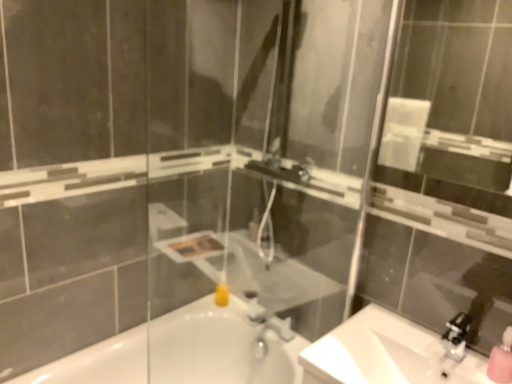
I want to click on matte silver faucet at center, so click(x=266, y=325).

The image size is (512, 384). In order to click on pink matte soap dispenser at lower right in this screenshot , I will do `click(501, 360)`.

Describe the element at coordinates (218, 347) in the screenshot. The height and width of the screenshot is (384, 512). I see `white glossy bathtub at lower center` at that location.

This screenshot has height=384, width=512. Describe the element at coordinates (456, 336) in the screenshot. I see `satin nickel faucet at lower right` at that location.

The image size is (512, 384). What are the coordinates of `satin nickel faucet at lower right` in the screenshot? It's located at (456, 336).

Locate an element on the screen. The height and width of the screenshot is (384, 512). white glossy sink at lower right is located at coordinates (384, 353).

You are a GUI agent. You are given a task and a screenshot of the screen. Output one action in this format:
    pyautogui.click(x=<x>, y=<y>)
    Task: Click on the matte silver faucet at center
    The image size is (512, 384).
    Given the screenshot: What is the action you would take?
    pyautogui.click(x=266, y=325)

How different are the orientations of clear glass mirror at upper center and pink matte soap dispenser at lower right in degrees?

There is a 1.48-degree angle between the facing directions of clear glass mirror at upper center and pink matte soap dispenser at lower right.

Looking at this image, from the image's perspective, is clear glass mirror at upper center under pink matte soap dispenser at lower right?

Incorrect, from the image's perspective, clear glass mirror at upper center is higher than pink matte soap dispenser at lower right.

Is clear glass mirror at upper center positioned far away from pink matte soap dispenser at lower right?

That's right, there is a large distance between clear glass mirror at upper center and pink matte soap dispenser at lower right.

Is matte silver faucet at center positioned beyond the bounds of pink matte soap dispenser at lower right?

Yes, matte silver faucet at center is not within pink matte soap dispenser at lower right.

Can you confirm if matte silver faucet at center is thinner than pink matte soap dispenser at lower right?

No, matte silver faucet at center is not thinner than pink matte soap dispenser at lower right.

Can you confirm if matte silver faucet at center is positioned to the right of pink matte soap dispenser at lower right?

In fact, matte silver faucet at center is to the left of pink matte soap dispenser at lower right.

In terms of height, does satin nickel faucet at lower right look taller or shorter compared to white glossy sink at lower right?

satin nickel faucet at lower right is shorter than white glossy sink at lower right.

Can we say satin nickel faucet at lower right lies outside white glossy sink at lower right?

satin nickel faucet at lower right is positioned outside white glossy sink at lower right.

Considering the points (442, 343) and (307, 356), which point is in front, point (442, 343) or point (307, 356)?

The point (307, 356) is in front.

From a real-world perspective, is satin nickel faucet at lower right physically above white glossy sink at lower right?

Yes, from a real-world perspective, satin nickel faucet at lower right is over white glossy sink at lower right

Is matte silver faucet at center with clear glass mirror at upper center?

matte silver faucet at center and clear glass mirror at upper center are clearly separated.

In the image, there is a clear glass mirror at upper center. At what (x,y) coordinates should I click in order to perform the action: click on tap below it (from the image's perspective). Please return your answer as a coordinate pair (x, y). Image resolution: width=512 pixels, height=384 pixels. Looking at the image, I should click on (266, 325).

Which object is closer to the camera, matte silver faucet at center or clear glass mirror at upper center?

clear glass mirror at upper center is closer to the camera.

Consider the image. Is matte silver faucet at center shorter than clear glass mirror at upper center?

Yes.

Considering the sizes of pink matte soap dispenser at lower right and matte silver faucet at center in the image, is pink matte soap dispenser at lower right taller or shorter than matte silver faucet at center?

Clearly, pink matte soap dispenser at lower right is taller compared to matte silver faucet at center.

Considering the relative sizes of pink matte soap dispenser at lower right and matte silver faucet at center in the image provided, is pink matte soap dispenser at lower right bigger than matte silver faucet at center?

No.

Does pink matte soap dispenser at lower right turn towards matte silver faucet at center?

No, pink matte soap dispenser at lower right is not oriented towards matte silver faucet at center.

Does point (510, 372) lie in front of point (254, 342)?

Yes, point (510, 372) is in front of point (254, 342).

From a real-world perspective, is white glossy sink at lower right above or below clear glass mirror at upper center?

From a real-world perspective, white glossy sink at lower right is physically below clear glass mirror at upper center.

Between white glossy sink at lower right and clear glass mirror at upper center, which one appears on the right side from the viewer's perspective?

clear glass mirror at upper center is more to the right.

In terms of width, does white glossy sink at lower right look wider or thinner when compared to clear glass mirror at upper center?

In the image, white glossy sink at lower right appears to be wider than clear glass mirror at upper center.

Consider the image. Is white glossy sink at lower right further to camera compared to clear glass mirror at upper center?

That is True.

Can you confirm if satin nickel faucet at lower right is smaller than white glossy bathtub at lower center?

Correct, satin nickel faucet at lower right occupies less space than white glossy bathtub at lower center.

Choose the correct answer: Is satin nickel faucet at lower right inside white glossy bathtub at lower center or outside it?

satin nickel faucet at lower right is outside white glossy bathtub at lower center.

Is satin nickel faucet at lower right at the right side of white glossy bathtub at lower center?

Yes, satin nickel faucet at lower right is to the right of white glossy bathtub at lower center.

At what (x,y) coordinates should I click in order to perform the action: click on soap dispenser behind the clear glass mirror at upper center. Please return your answer as a coordinate pair (x, y). The height and width of the screenshot is (384, 512). Looking at the image, I should click on (501, 360).

In the image, there is a pink matte soap dispenser at lower right. At what (x,y) coordinates should I click in order to perform the action: click on tap below it (from a real-world perspective). Please return your answer as a coordinate pair (x, y). Looking at the image, I should click on (266, 325).

Based on their spatial positions, is matte silver faucet at center or white glossy sink at lower right closer to satin nickel faucet at lower right?

white glossy sink at lower right is positioned closer to the anchor satin nickel faucet at lower right.

Looking at this image, based on their spatial positions, is white glossy sink at lower right or clear glass mirror at upper center closer to white glossy bathtub at lower center?

white glossy sink at lower right.

Looking at this image, when comparing their distances from matte silver faucet at center, does satin nickel faucet at lower right or white glossy bathtub at lower center seem further?

satin nickel faucet at lower right is positioned further to the anchor matte silver faucet at center.

Estimate the real-world distances between objects in this image. Which object is closer to pink matte soap dispenser at lower right, matte silver faucet at center or clear glass mirror at upper center?

matte silver faucet at center.

Based on their spatial positions, is clear glass mirror at upper center or white glossy bathtub at lower center closer to white glossy sink at lower right?

The object closer to white glossy sink at lower right is white glossy bathtub at lower center.

When comparing their distances from clear glass mirror at upper center, does pink matte soap dispenser at lower right or white glossy sink at lower right seem closer?

white glossy sink at lower right lies closer to clear glass mirror at upper center than the other object.

When comparing their distances from white glossy bathtub at lower center, does pink matte soap dispenser at lower right or matte silver faucet at center seem further?

pink matte soap dispenser at lower right.

Estimate the real-world distances between objects in this image. Which object is further from clear glass mirror at upper center, matte silver faucet at center or white glossy bathtub at lower center?

white glossy bathtub at lower center lies further to clear glass mirror at upper center than the other object.

This screenshot has height=384, width=512. I want to click on tap between clear glass mirror at upper center and white glossy sink at lower right from top to bottom, so click(266, 325).

In order to click on sink between white glossy bathtub at lower center and pink matte soap dispenser at lower right in this screenshot , I will do `click(384, 353)`.

Image resolution: width=512 pixels, height=384 pixels. In order to click on soap dispenser between clear glass mirror at upper center and matte silver faucet at center vertically in this screenshot , I will do `click(501, 360)`.

Identify the location of soap dispenser between clear glass mirror at upper center and white glossy bathtub at lower center from top to bottom. (501, 360).